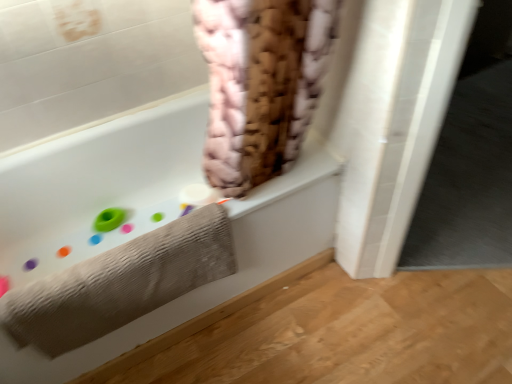
Question: Is gray textured towel at lower left thinner than white matte toilet paper at upper center?

Choices:
 (A) yes
 (B) no

Answer: (B)

Question: Does gray textured towel at lower left appear on the right side of white matte toilet paper at upper center?

Choices:
 (A) no
 (B) yes

Answer: (A)

Question: Is gray textured towel at lower left bigger than white matte toilet paper at upper center?

Choices:
 (A) no
 (B) yes

Answer: (B)

Question: Considering the relative sizes of gray textured towel at lower left and white matte toilet paper at upper center in the image provided, is gray textured towel at lower left smaller than white matte toilet paper at upper center?

Choices:
 (A) yes
 (B) no

Answer: (B)

Question: From a real-world perspective, does gray textured towel at lower left sit lower than white matte toilet paper at upper center?

Choices:
 (A) yes
 (B) no

Answer: (B)

Question: Considering the positions of point (187, 200) and point (18, 357), is point (187, 200) closer or farther from the camera than point (18, 357)?

Choices:
 (A) farther
 (B) closer

Answer: (A)

Question: Considering the positions of white matte toilet paper at upper center and white matte bathtub at upper left in the image, is white matte toilet paper at upper center taller or shorter than white matte bathtub at upper left?

Choices:
 (A) tall
 (B) short

Answer: (B)

Question: Would you say white matte toilet paper at upper center is inside or outside white matte bathtub at upper left?

Choices:
 (A) outside
 (B) inside

Answer: (B)

Question: Considering the positions of white matte toilet paper at upper center and white matte bathtub at upper left in the image, is white matte toilet paper at upper center wider or thinner than white matte bathtub at upper left?

Choices:
 (A) thin
 (B) wide

Answer: (A)

Question: Visually, is white matte bathtub at upper left positioned to the left or to the right of gray textured towel at lower left?

Choices:
 (A) right
 (B) left

Answer: (B)

Question: Would you say white matte bathtub at upper left is inside or outside gray textured towel at lower left?

Choices:
 (A) inside
 (B) outside

Answer: (B)

Question: From the image's perspective, is white matte bathtub at upper left located above or below gray textured towel at lower left?

Choices:
 (A) below
 (B) above

Answer: (B)

Question: Looking at the image, does white matte bathtub at upper left seem bigger or smaller compared to gray textured towel at lower left?

Choices:
 (A) big
 (B) small

Answer: (A)

Question: From the image's perspective, is white matte toilet paper at upper center positioned above or below gray textured towel at lower left?

Choices:
 (A) above
 (B) below

Answer: (A)

Question: Would you say white matte toilet paper at upper center is to the left or to the right of gray textured towel at lower left in the picture?

Choices:
 (A) right
 (B) left

Answer: (A)